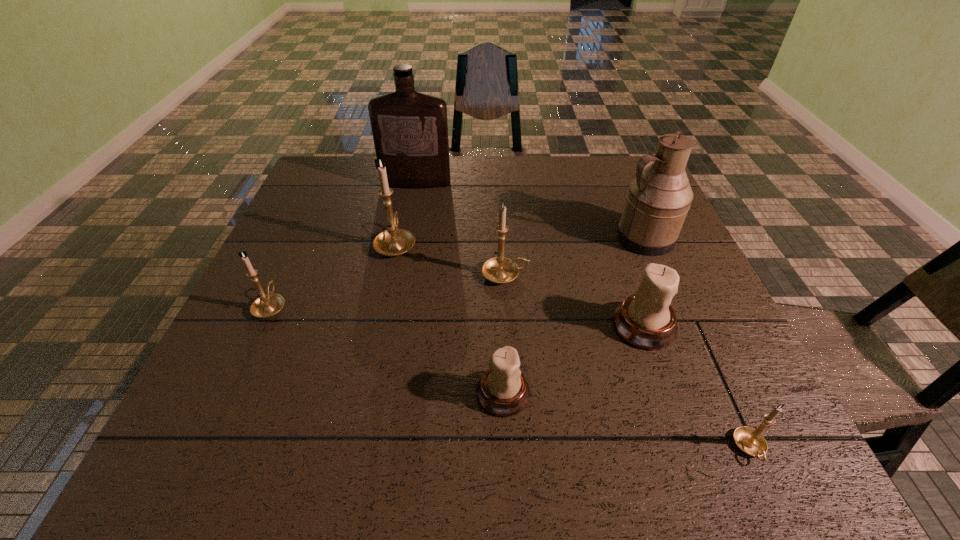
This screenshot has height=540, width=960. I want to click on free space located 0.170m on the front of the second candle holder from right to left, so click(x=680, y=431).

The image size is (960, 540). What are the coordinates of `free space located 0.230m on the handle side of the leftmost candle holder` in the screenshot? It's located at (306, 230).

The image size is (960, 540). I want to click on vacant space positioned on the handle side of the leftmost candle holder, so click(306, 230).

Locate an element on the screen. vacant space located on the handle side of the leftmost candle holder is located at coordinates (297, 249).

Identify the location of blank area located 0.090m on the left of the seventh farthest object. (427, 393).

This screenshot has height=540, width=960. Find the location of `object positioned at the far edge`. object positioned at the far edge is located at coordinates (410, 129).

The width and height of the screenshot is (960, 540). Find the location of `object at the near edge`. object at the near edge is located at coordinates (751, 441).

The height and width of the screenshot is (540, 960). I want to click on object that is at the left edge, so click(267, 305).

Identify the location of pitcher at the right edge. pyautogui.click(x=659, y=198).

At what (x,y) coordinates should I click in order to perform the action: click on object located at the near right corner. Please return your answer as a coordinate pair (x, y). The width and height of the screenshot is (960, 540). Looking at the image, I should click on (751, 441).